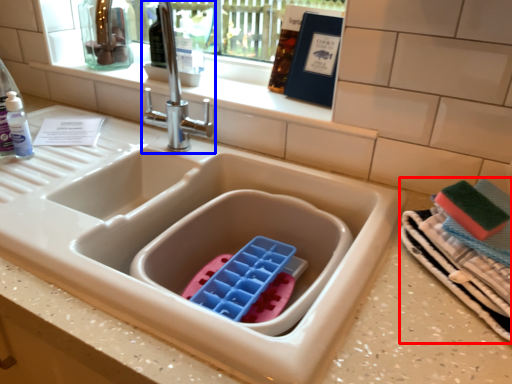
Question: Which object is closer to the camera taking this photo, laundry (highlighted by a red box) or tap (highlighted by a blue box)?

Choices:
 (A) laundry
 (B) tap

Answer: (A)